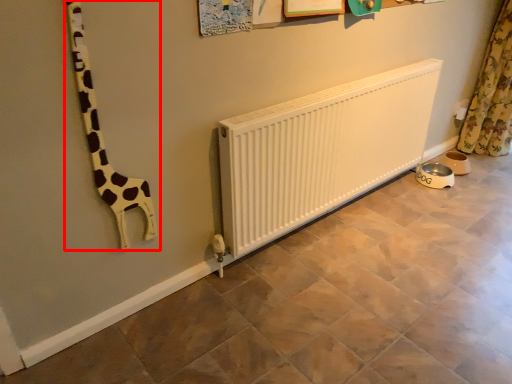
Question: Considering the relative positions of giraffe (annotated by the red box) and curtain in the image provided, where is giraffe (annotated by the red box) located with respect to the staircase?

Choices:
 (A) right
 (B) left

Answer: (B)